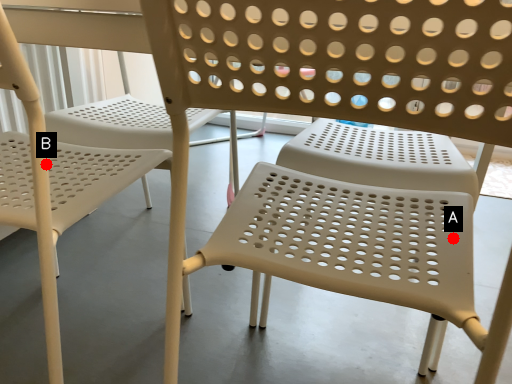
Question: Two points are circled on the image, labeled by A and B beside each circle. Which point is closer to the camera?

Choices:
 (A) A is closer
 (B) B is closer

Answer: (B)